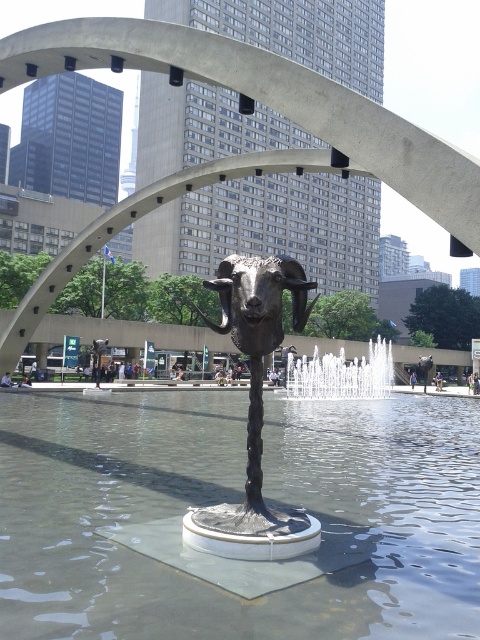
You are a maintenance worker responsible for ensuring safety around the sculpture. The clear glass water at center and white frothy water at center are both part of the sculpture base. You need to place a warning sign that is 2 meters wide between them. Can you fit the sign without overlapping either water feature?

The distance between the clear glass water at center and white frothy water at center is 14.50 meters. Since the warning sign is only 2 meters wide, there is sufficient space to place it between them without overlapping either water feature.

You are standing in the urban setting shown in the image. You see a point marked at coordinates (254, 412). What object is located at that point?

The point at coordinates (254, 412) indicates the black polished metal ram at center.

You are standing in front of the sculpture and looking at the two points marked in the image. Which of the two points, point [299,518] or point [238,259], is closer to your eyes?

Point [299,518] is closer to the camera than point [238,259], so it is closer to your eyes.